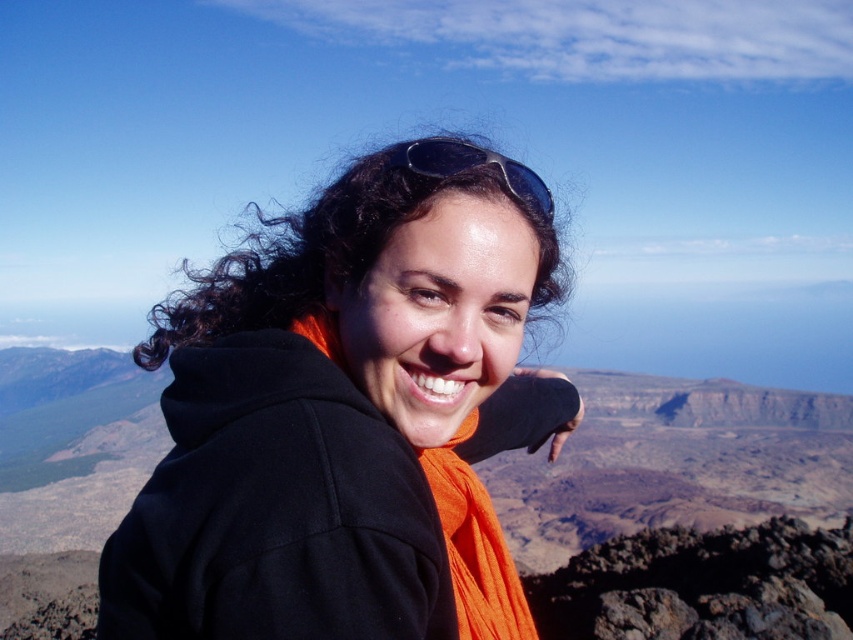
Is black fleece jacket at center above black plastic sunglasses at upper center?

No.

Looking at this image, is black fleece jacket at center further to camera compared to black plastic sunglasses at upper center?

That is False.

This screenshot has height=640, width=853. What do you see at coordinates (347, 416) in the screenshot? I see `black fleece jacket at center` at bounding box center [347, 416].

Identify the location of black fleece jacket at center. (347, 416).